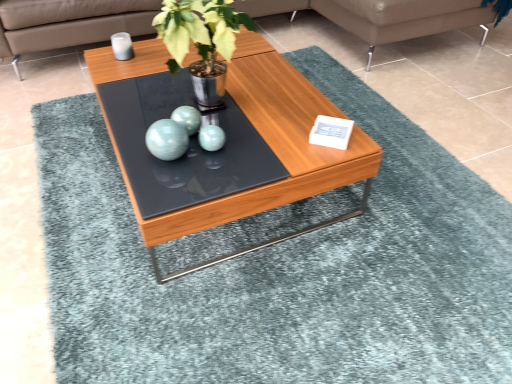
I want to click on free spot to the right of metallic green plant at center, so click(291, 112).